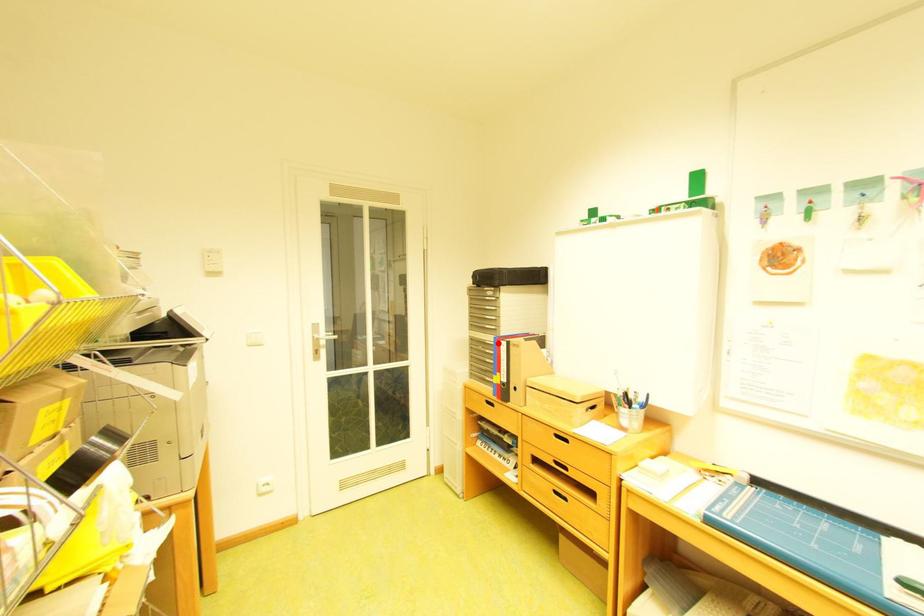
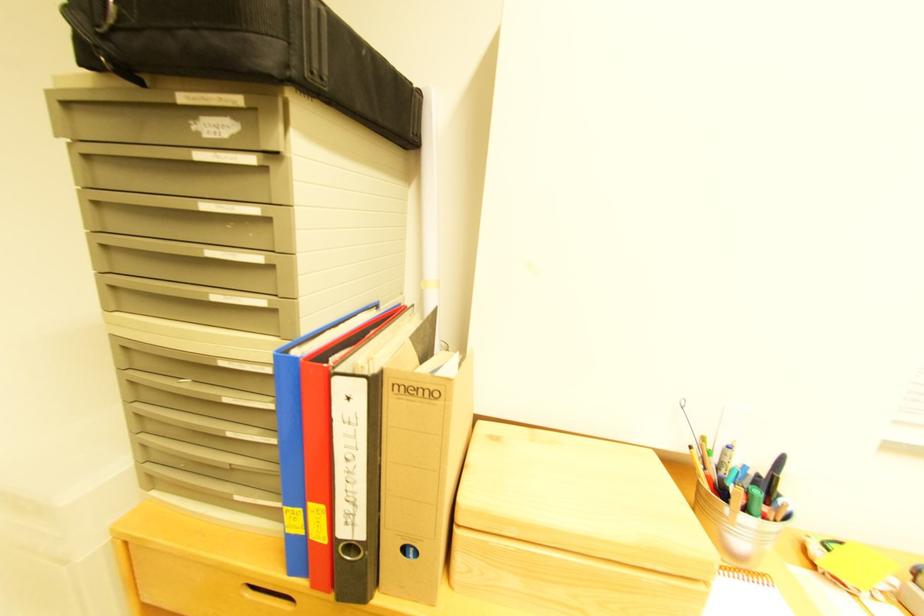
Locate, in the second image, the point that corresponds to the highlighted location in the first image.

(235, 363)